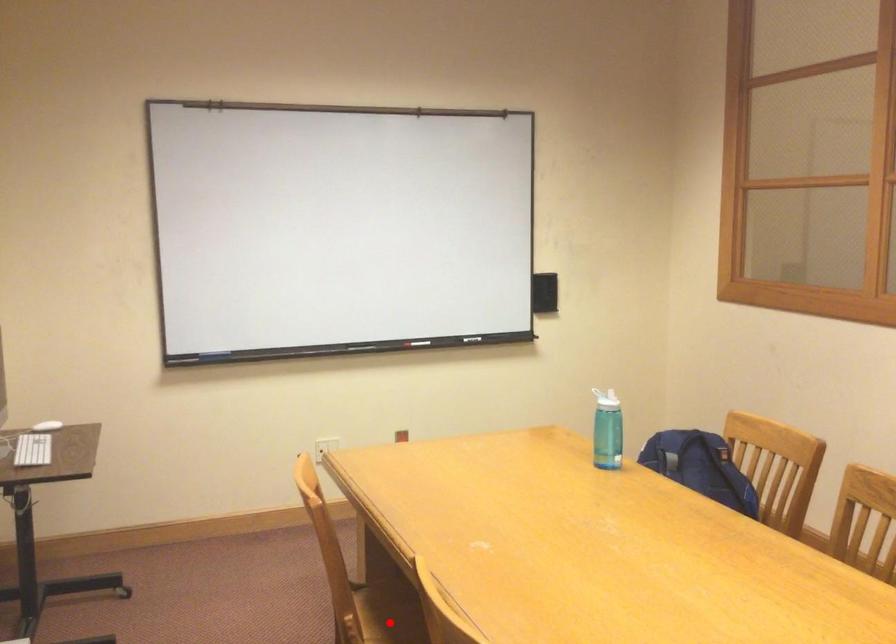
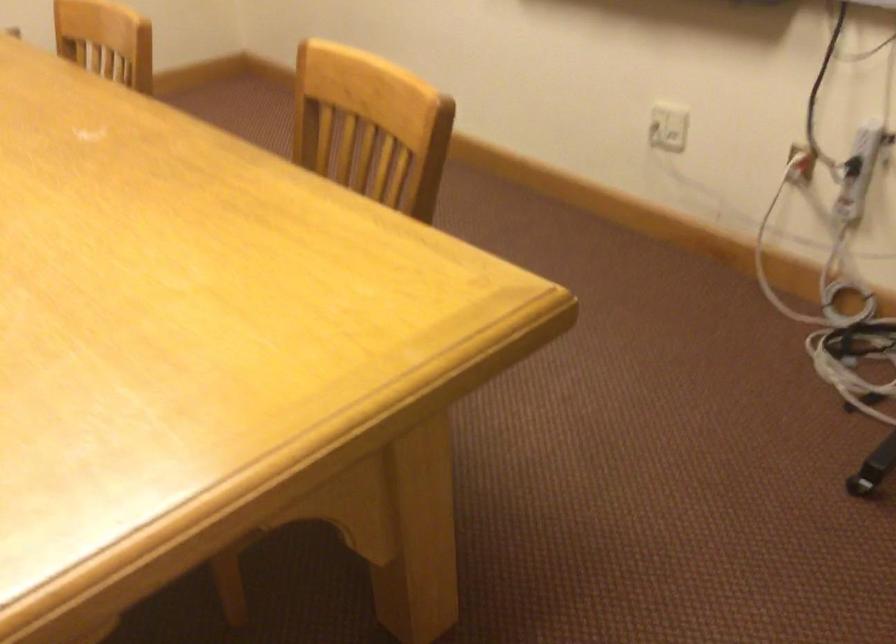
Question: I am providing you with two images of the same scene from different viewpoints. A red point is marked on the first image. At the location where the point appears in image 1, is it still visible in image 2?

Choices:
 (A) Yes
 (B) No

Answer: (B)